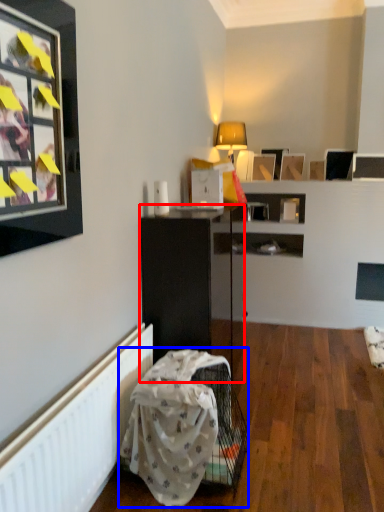
Question: Which object appears closest to the camera in this image, shelf (highlighted by a red box) or swivel chair (highlighted by a blue box)?

Choices:
 (A) shelf
 (B) swivel chair

Answer: (B)